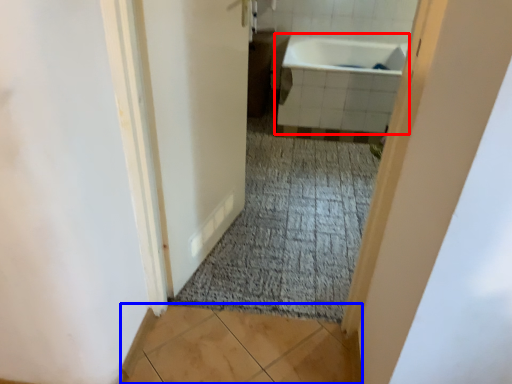
Question: Which object is closer to the camera taking this photo, bathtub (highlighted by a red box) or tile (highlighted by a blue box)?

Choices:
 (A) bathtub
 (B) tile

Answer: (B)